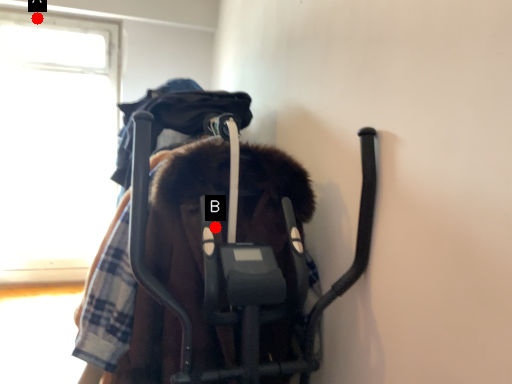
Question: Two points are circled on the image, labeled by A and B beside each circle. Which of the following is the closest to the observer?

Choices:
 (A) A is closer
 (B) B is closer

Answer: (B)